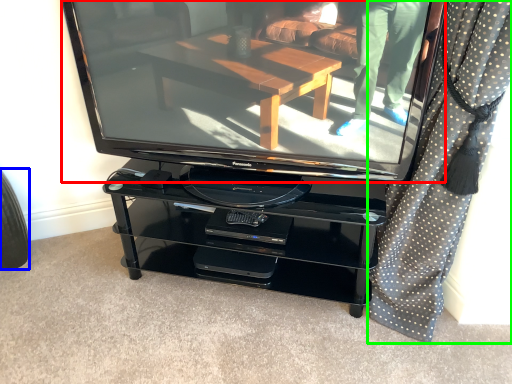
Question: Based on their relative distances, which object is nearer to television (highlighted by a red box)? Choose from tire (highlighted by a blue box) and curtain (highlighted by a green box).

Choices:
 (A) tire
 (B) curtain

Answer: (B)